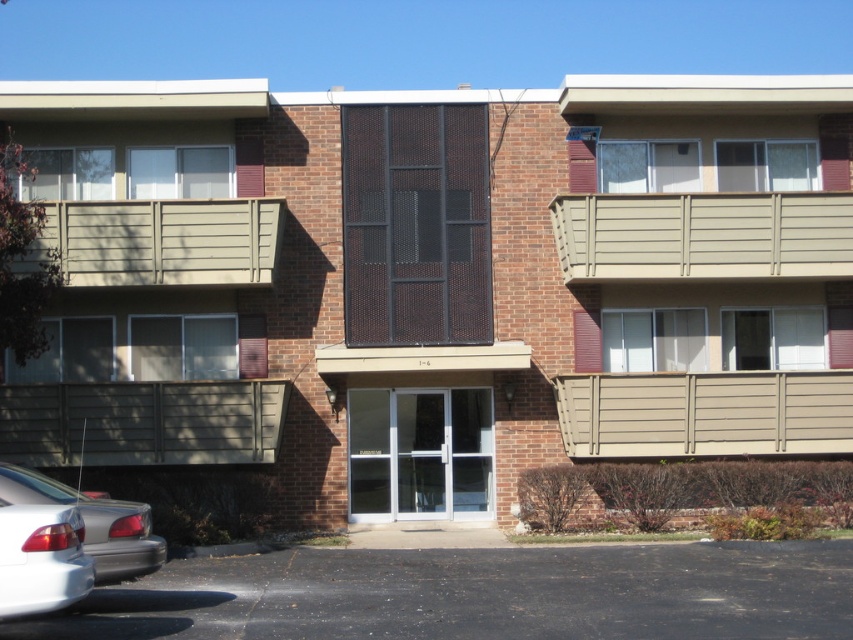
Question: Is beige wood balcony at center to the right of brown textured panel at lower left from the viewer's perspective?

Choices:
 (A) yes
 (B) no

Answer: (A)

Question: Which object is closer to the camera taking this photo?

Choices:
 (A) beige wood balcony at left
 (B) white glossy sedan at lower left
 (C) beige wood balcony at center
 (D) tan wood paneling at upper right

Answer: (B)

Question: Which object is positioned farthest from the tan wood paneling at upper right?

Choices:
 (A) brown textured panel at lower left
 (B) white glossy sedan at lower left
 (C) beige wood balcony at left
 (D) beige wood balcony at center

Answer: (B)

Question: Which point is closer to the camera?

Choices:
 (A) (59, 220)
 (B) (763, 452)

Answer: (A)

Question: Observing the image, what is the correct spatial positioning of beige wood balcony at left in reference to white glossy sedan at lower left?

Choices:
 (A) above
 (B) below

Answer: (A)

Question: Can you confirm if white glossy sedan at lower left is smaller than satin silver sedan at lower left?

Choices:
 (A) no
 (B) yes

Answer: (B)